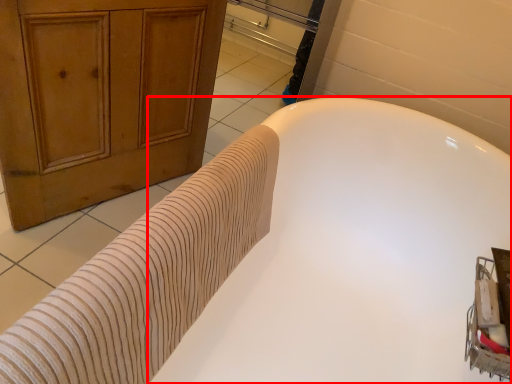
Question: From the image's perspective, where is bathtub (annotated by the red box) located in relation to bath towel in the image?

Choices:
 (A) below
 (B) above

Answer: (A)